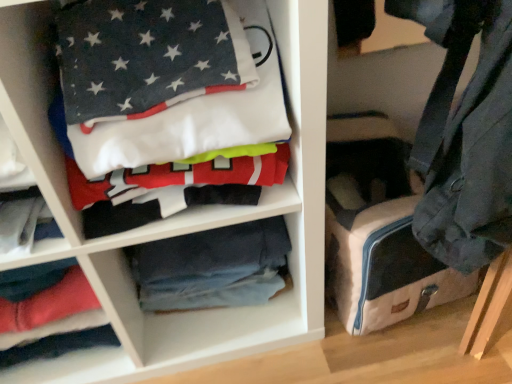
Identify the location of free area below canvas suitcase at lower right (from a real-world perspective). [415, 319].